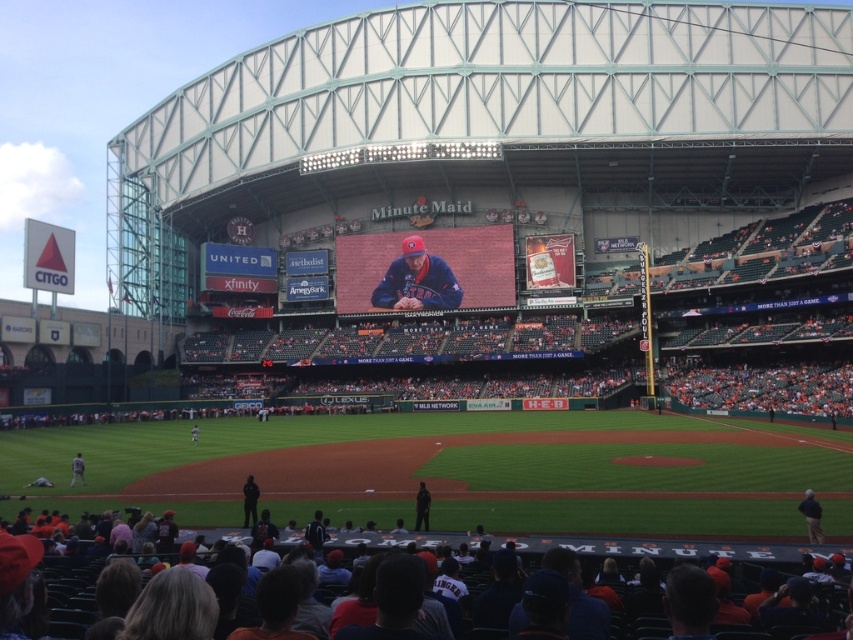
Is black uniform at lower center bigger than black uniform at center?

Yes.

Who is lower down, black uniform at lower center or black uniform at center?

black uniform at lower center is below.

This screenshot has height=640, width=853. What do you see at coordinates (248, 500) in the screenshot?
I see `black uniform at lower center` at bounding box center [248, 500].

Where is `black uniform at lower center`? This screenshot has width=853, height=640. black uniform at lower center is located at coordinates (248, 500).

Does matte blue cap at center come in front of gray fabric jacket at lower left?

No, matte blue cap at center is further to the viewer.

Who is shorter, matte blue cap at center or gray fabric jacket at lower left?

Standing shorter between the two is gray fabric jacket at lower left.

Which is in front, point (451, 275) or point (71, 483)?

Point (71, 483) is in front.

Find the location of a particular element. matte blue cap at center is located at coordinates (416, 280).

Between dark blue jersey at lower center and black fabric jacket at lower right, which one has more height?

Standing taller between the two is dark blue jersey at lower center.

Is dark blue jersey at lower center further to the viewer compared to black fabric jacket at lower right?

No, dark blue jersey at lower center is closer to the viewer.

Between point (96, 577) and point (822, 536), which one is positioned behind?

Positioned behind is point (822, 536).

The width and height of the screenshot is (853, 640). In order to click on dark blue jersey at lower center in this screenshot , I will do `click(71, 589)`.